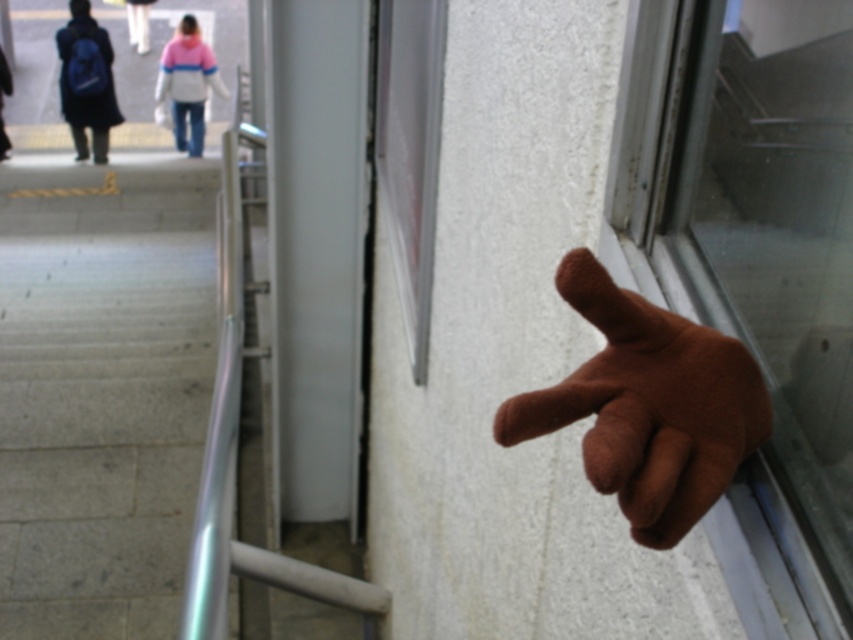
Does gray concrete stairs at lower left have a greater width compared to pink fleece jacket at upper center?

No, gray concrete stairs at lower left is not wider than pink fleece jacket at upper center.

Who is taller, gray concrete stairs at lower left or pink fleece jacket at upper center?

pink fleece jacket at upper center is taller.

Is point (105, 540) positioned before point (136, 40)?

Yes, point (105, 540) is closer to viewer.

The height and width of the screenshot is (640, 853). I want to click on gray concrete stairs at lower left, so click(102, 388).

Who is more distant from viewer, (602, 461) or (88, 99)?

Positioned behind is point (88, 99).

Who is more forward, (508, 404) or (94, 38)?

Point (508, 404)

This screenshot has height=640, width=853. In order to click on brown fuzzy hand at center in this screenshot , I will do `click(648, 404)`.

Does transparent glass window at right have a lesser height compared to matte blue backpack at left?

Correct, transparent glass window at right is not as tall as matte blue backpack at left.

Does transparent glass window at right have a greater width compared to matte blue backpack at left?

No, transparent glass window at right is not wider than matte blue backpack at left.

Which is in front, point (753, 83) or point (99, 81)?

Point (753, 83) is more forward.

Where is `transparent glass window at right`? The image size is (853, 640). transparent glass window at right is located at coordinates (753, 264).